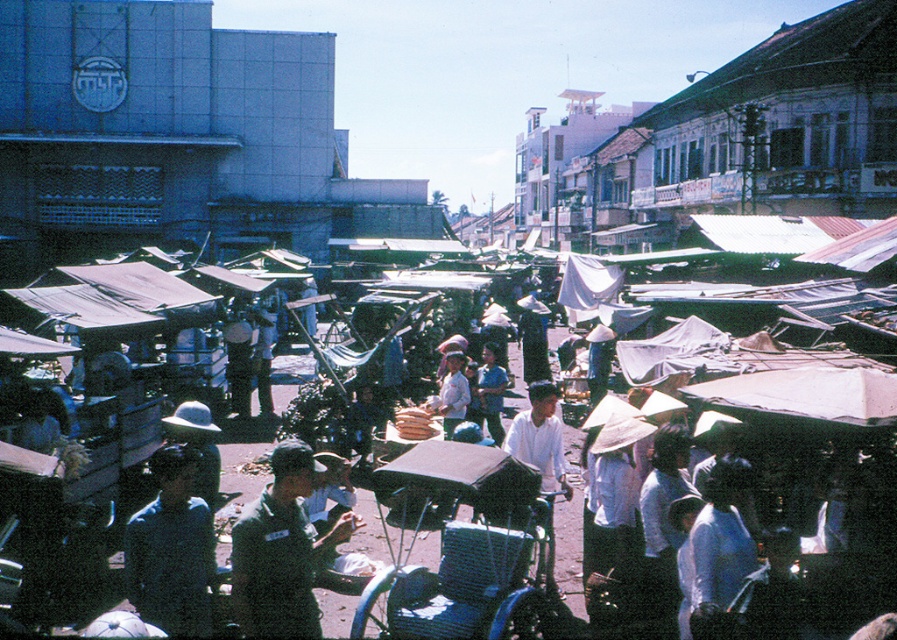
You are a photographer at the market and want to capture both the dark green uniform at center and the dark blue shirt at lower left in a single shot. Which person should you position closer to the camera to ensure both fit in the frame?

Since the dark green uniform at center is narrower than the dark blue shirt at lower left, you should position the person in the dark green uniform at center closer to the camera to ensure both fit within the frame.

You are a customer at the market and want to reach the dark blue shirt at lower left without going through the white fabric market stalls at center. Is there a clear path available around them?

The white fabric market stalls at center is positioned over dark blue shirt at lower left, so there is no clear path around them. You would need to navigate around the stalls to reach the dark blue shirt at lower left.